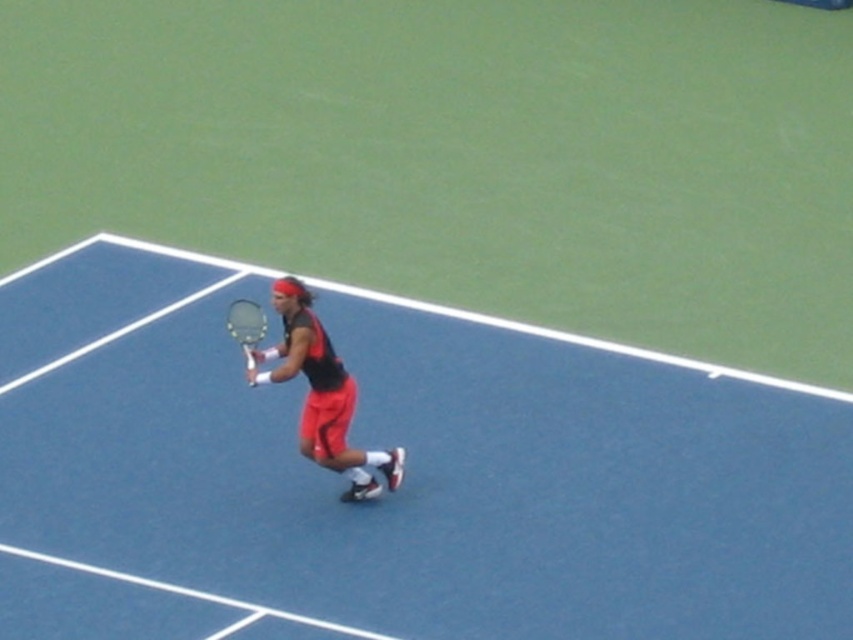
Does point (305, 346) come in front of point (247, 326)?

Yes.

Identify the location of matte black tennis racket at center. (322, 394).

Who is more forward, (x=367, y=547) or (x=230, y=314)?

Point (x=367, y=547)

Between point (677, 429) and point (248, 332), which one is positioned behind?

Positioned behind is point (677, 429).

Does point (453, 323) come closer to viewer compared to point (236, 333)?

That is False.

Locate an element on the screen. This screenshot has width=853, height=640. blue rubber tennis court at center is located at coordinates (404, 480).

Can you confirm if blue rubber tennis court at center is taller than matte black tennis racket at center?

Incorrect, blue rubber tennis court at center's height is not larger of matte black tennis racket at center's.

Who is positioned more to the left, blue rubber tennis court at center or matte black tennis racket at center?

matte black tennis racket at center

At what (x,y) coordinates should I click in order to perform the action: click on blue rubber tennis court at center. Please return your answer as a coordinate pair (x, y). Looking at the image, I should click on (404, 480).

Where is `blue rubber tennis court at center`? blue rubber tennis court at center is located at coordinates (404, 480).